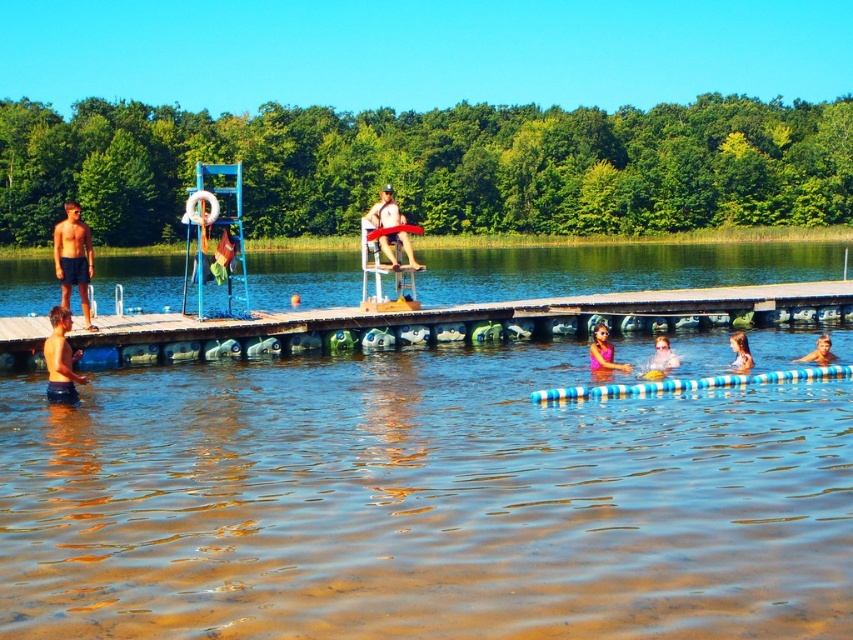
You are a swimmer who wants to retrieve the smooth blue swim ring at lower right from the water. The blue wooden dock at center is in your way. Can you reach the swim ring without climbing onto the dock?

The blue wooden dock at center is much taller than the smooth blue swim ring at lower right, so you can reach the swim ring without climbing onto the dock because the dock is elevated above the swim ring.

You are a swimmer wanting to jump into the lake from the dock. The blue wooden dock at center and the pink matte swimsuit at lower center are in your view. Which object is higher and thus safer to jump from?

The blue wooden dock at center is taller than the pink matte swimsuit at lower center, so jumping from the blue wooden dock at center would be safer as it is higher.

You are a lifeguard on duty and you see a swimmer in trouble near the water. You need to quickly grab the nearest lifebuoy. The lifebuoy is hanging from the blue ladder on the dock. Where is the lifebuoy located relative to the matte blue shorts at left?

The lifebuoy is located to the right of the matte blue shorts at left.